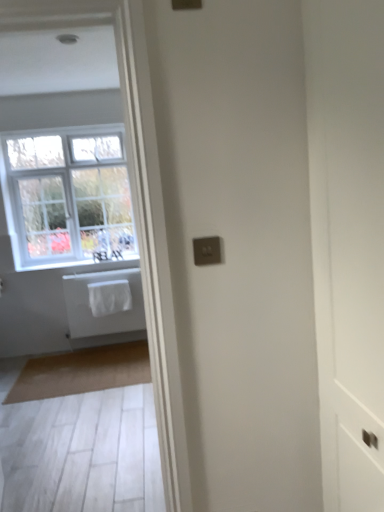
Question: Is white matte towel at left directly adjacent to white fabric at lower left?

Choices:
 (A) yes
 (B) no

Answer: (B)

Question: Does white matte towel at left have a smaller size compared to white fabric at lower left?

Choices:
 (A) yes
 (B) no

Answer: (B)

Question: Can you confirm if white matte towel at left is shorter than white fabric at lower left?

Choices:
 (A) yes
 (B) no

Answer: (B)

Question: From the image's perspective, is white matte towel at left located beneath white fabric at lower left?

Choices:
 (A) yes
 (B) no

Answer: (A)

Question: Is white matte towel at left at the right side of white fabric at lower left?

Choices:
 (A) yes
 (B) no

Answer: (A)

Question: From the image's perspective, would you say white matte towel at left is positioned over white fabric at lower left?

Choices:
 (A) yes
 (B) no

Answer: (B)

Question: Does satin gold switchplate at center have a lesser width compared to white painted wood window at upper left?

Choices:
 (A) yes
 (B) no

Answer: (A)

Question: Is satin gold switchplate at center oriented towards white painted wood window at upper left?

Choices:
 (A) no
 (B) yes

Answer: (A)

Question: From a real-world perspective, is satin gold switchplate at center under white painted wood window at upper left?

Choices:
 (A) no
 (B) yes

Answer: (B)

Question: Is there a large distance between satin gold switchplate at center and white painted wood window at upper left?

Choices:
 (A) no
 (B) yes

Answer: (B)

Question: Can you confirm if satin gold switchplate at center is wider than white painted wood window at upper left?

Choices:
 (A) yes
 (B) no

Answer: (B)

Question: Is satin gold switchplate at center touching white painted wood window at upper left?

Choices:
 (A) yes
 (B) no

Answer: (B)

Question: Does satin gold switchplate at center have a greater height compared to white fabric laundry at center?

Choices:
 (A) no
 (B) yes

Answer: (A)